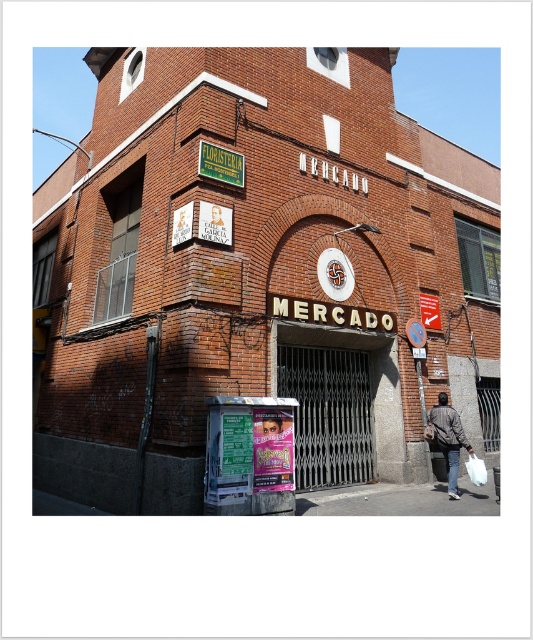
You are standing in front of the brick building at center and the metallic poster at lower center. Which object is closer to your right side?

The brick building at center is positioned on the right side of the metallic poster at lower center, so the brick building at center is closer to your right side.

You are a delivery person trying to find the entrance to the building. You see the brick building at center and the metallic poster at lower center. Which one is larger in size?

The brick building at center is bigger than the metallic poster at lower center, so the brick building at center is larger in size.

You are standing in front of the brick building at center and notice the metallic poster at lower center. Can you tell me the relative position of the brick building compared to the metallic poster?

The brick building at center is located above the metallic poster at lower center.